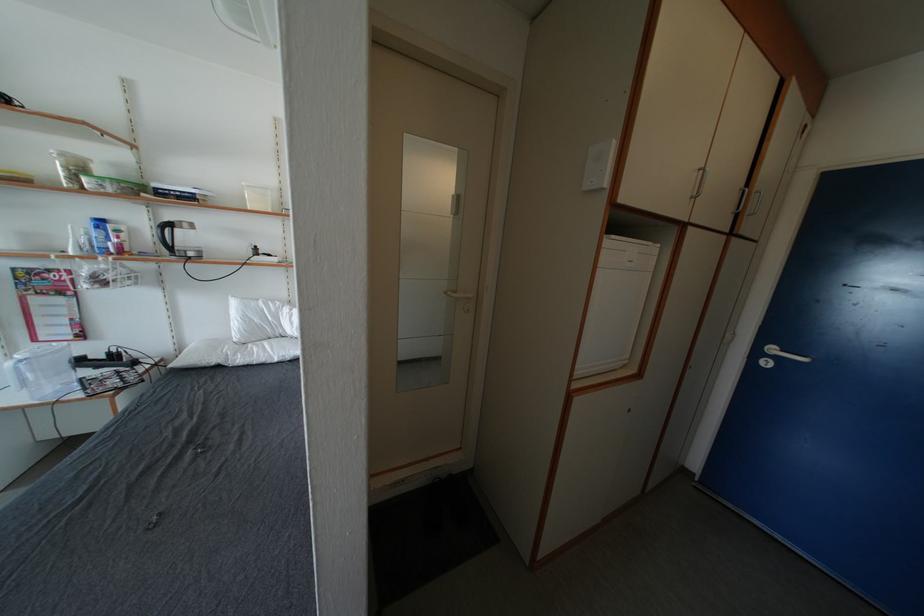
This screenshot has width=924, height=616. I want to click on silver door handle, so click(781, 355).